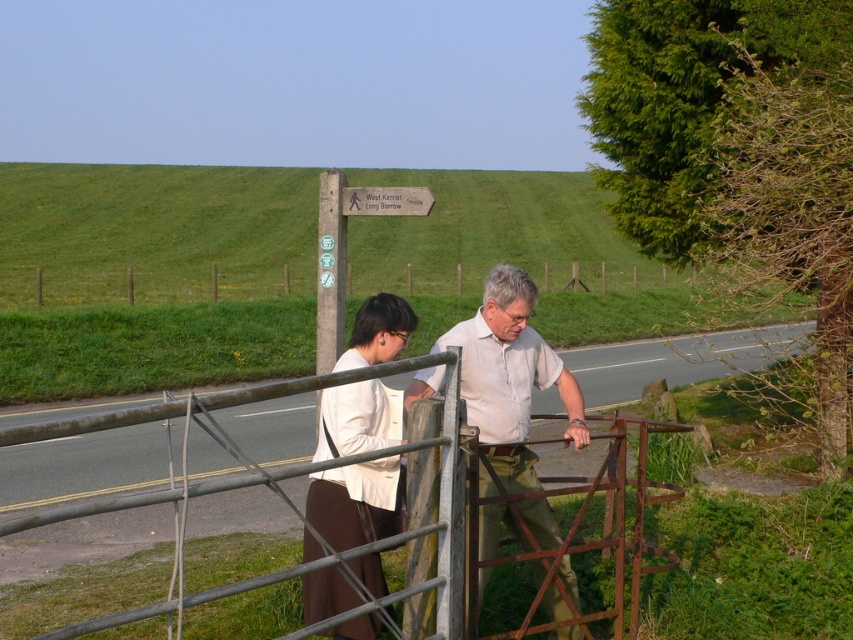
Question: Which object is the farthest from the wooden signpost at upper center?

Choices:
 (A) rusty metal gate at center
 (B) green wooden fence at center
 (C) white fabric jacket at center

Answer: (B)

Question: Among these objects, which one is nearest to the camera?

Choices:
 (A) green wooden fence at center
 (B) rusty metal gate at center
 (C) wooden signpost at upper center
 (D) light beige shirt at center

Answer: (B)

Question: Can you confirm if light beige shirt at center is positioned below wooden signpost at upper center?

Choices:
 (A) yes
 (B) no

Answer: (A)

Question: Is the position of rusty metal gate at center less distant than that of wooden signpost at upper center?

Choices:
 (A) no
 (B) yes

Answer: (B)

Question: Which point appears closest to the camera in this image?

Choices:
 (A) (456, 452)
 (B) (387, 422)
 (C) (392, 208)

Answer: (A)

Question: Considering the relative positions of light beige shirt at center and rusty metal gate at center in the image provided, where is light beige shirt at center located with respect to rusty metal gate at center?

Choices:
 (A) left
 (B) right

Answer: (B)